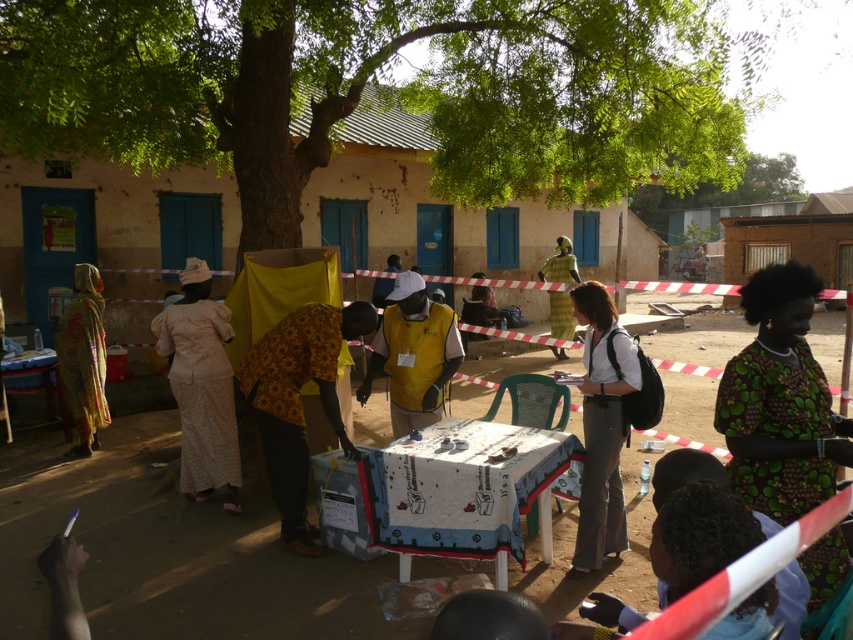
You are standing in front of the table with the white cloth and need to place a small object on the table. Which point, point (300, 506) or point (540, 269), is closer to you when viewed from your position?

Point (300, 506) is closer to the camera than point (540, 269), so it is closer to you when viewed from your position.

You are attending an outdoor event and want to sit between the yellow floral dress at center and the white fabric shirt at center. Is there enough space for you to sit comfortably?

The yellow floral dress at center might be wider than the white fabric shirt at center, so there may not be enough space for you to sit comfortably between them.

You are organizing a photoshoot and need to ensure that the yellow floral dress at center and the white fabric shirt at center are both visible in the frame. Given their sizes, which one might require more space to accommodate in the photo?

The yellow floral dress at center has a larger size compared to the white fabric shirt at center, so it would require more space to accommodate in the photo.